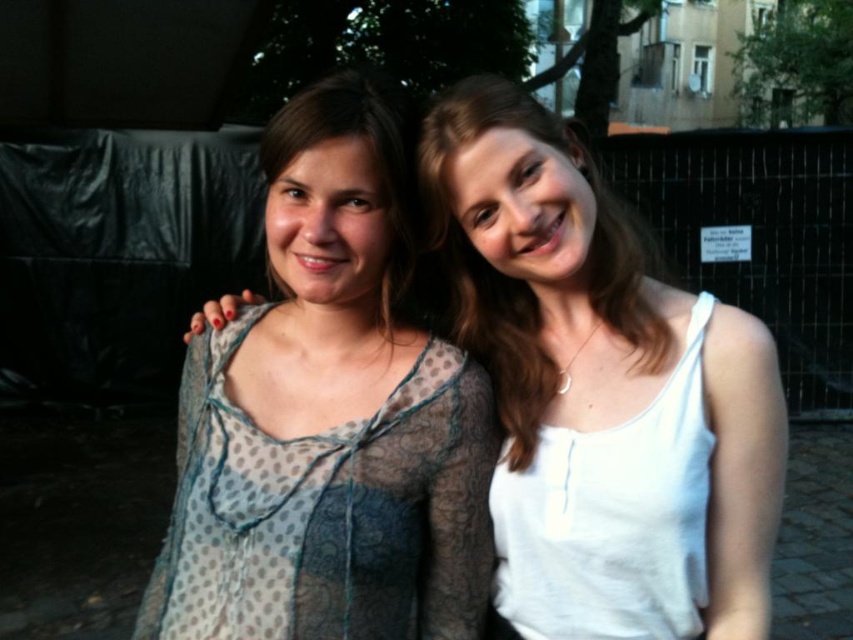
You are a photographer trying to capture the translucent polka dot dress at center in your shot. Based on its position coordinates, where should you aim your camera?

The translucent polka dot dress at center is located at coordinates point (328, 512), so you should aim your camera at that specific point to capture it.

You are trying to decide which tank top to wear for a casual day out. You have the white cotton tank top at right and the white matte tank top at center. Which one is more suitable if you want a smaller size?

The white cotton tank top at right is smaller than the white matte tank top at center, so it is more suitable if you want a smaller size.

You are a fashion designer observing two outfits in an outdoor setting. You notice the translucent polka dot dress at center and the white cotton tank top at right. Which outfit is positioned higher relative to the other?

The translucent polka dot dress at center is located above the white cotton tank top at right.